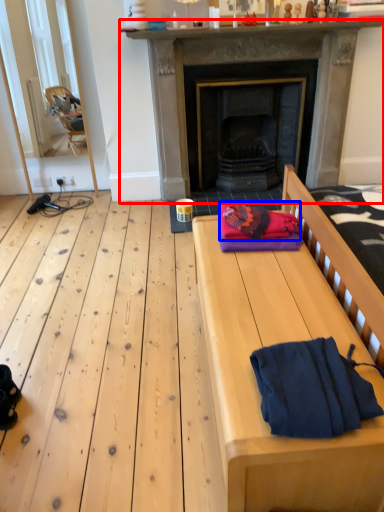
Question: Which object is closer to the camera taking this photo, fireplace (highlighted by a red box) or blanket (highlighted by a blue box)?

Choices:
 (A) fireplace
 (B) blanket

Answer: (B)